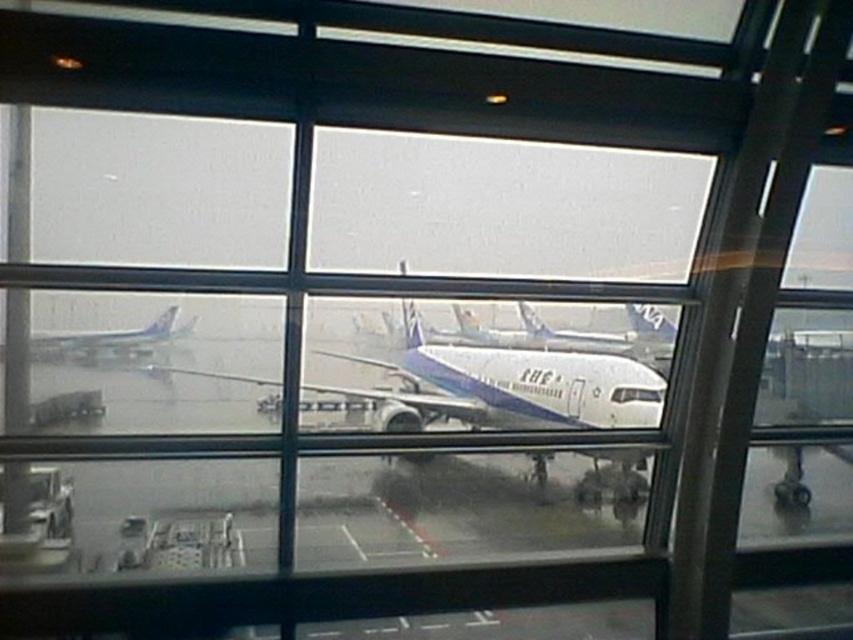
Does white glossy airplane at center have a lesser height compared to white glossy airplane at left?

Incorrect, white glossy airplane at center's height does not fall short of white glossy airplane at left's.

Is white glossy airplane at center bigger than white glossy airplane at left?

Correct, white glossy airplane at center is larger in size than white glossy airplane at left.

Between point (387, 362) and point (73, 344), which one is positioned behind?

The point (387, 362) is behind.

Where is `white glossy airplane at center`? Image resolution: width=853 pixels, height=640 pixels. white glossy airplane at center is located at coordinates (506, 380).